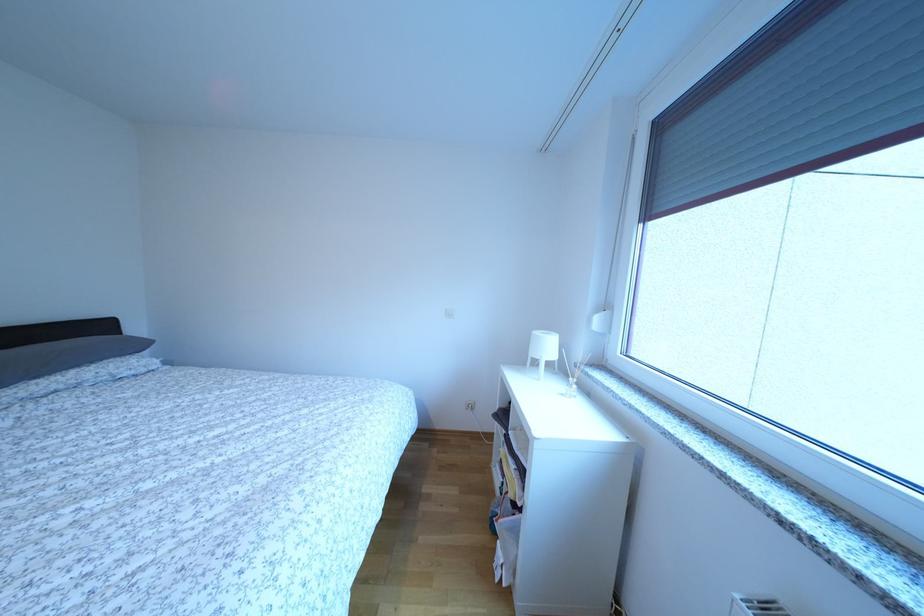
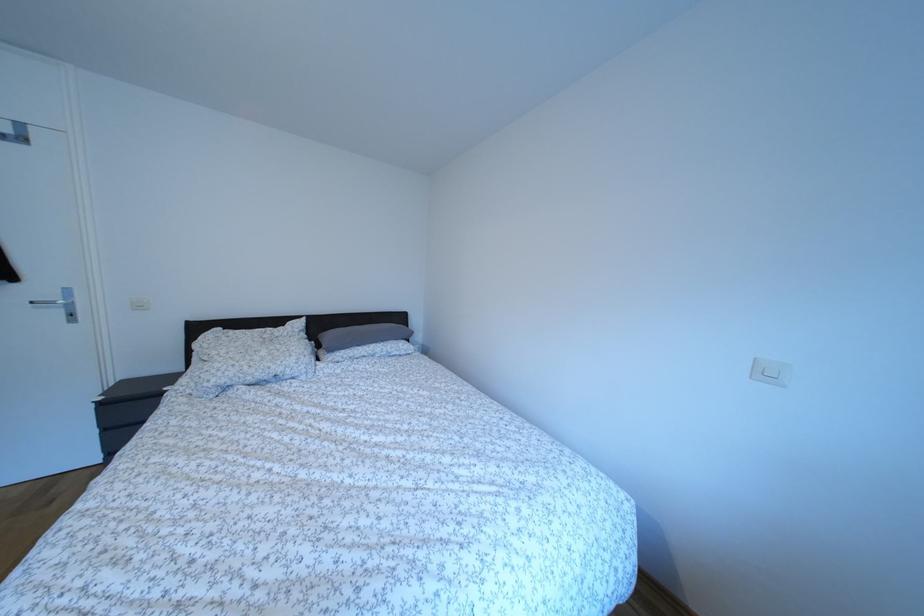
Question: How did the camera likely rotate?

Choices:
 (A) Left
 (B) Right
 (C) Up
 (D) Down

Answer: (A)